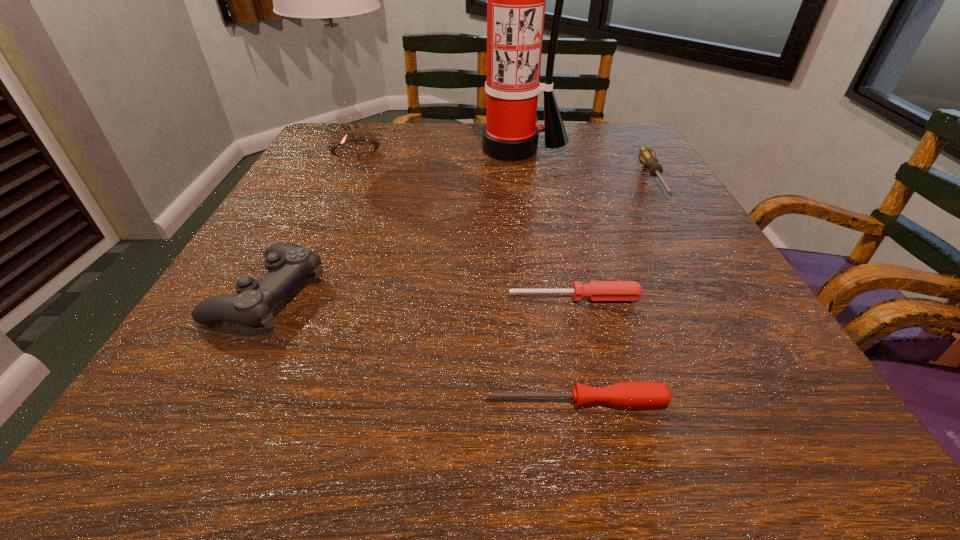
Locate an element on the screen. control that is at the left edge is located at coordinates (287, 263).

Locate an element on the screen. This screenshot has height=540, width=960. object located in the right edge section of the desktop is located at coordinates (647, 157).

The width and height of the screenshot is (960, 540). I want to click on object that is at the far left corner, so click(x=328, y=0).

What are the coordinates of `object that is at the far right corner` in the screenshot? It's located at (647, 157).

Where is `vacant space at the far edge of the desktop`? This screenshot has width=960, height=540. vacant space at the far edge of the desktop is located at coordinates (475, 147).

The height and width of the screenshot is (540, 960). Identify the location of vacant space at the near edge of the desktop. (690, 421).

Locate an element on the screen. blank space at the left edge of the desktop is located at coordinates (343, 204).

Image resolution: width=960 pixels, height=540 pixels. In order to click on vacant space at the right edge of the desktop in this screenshot , I will do `click(618, 199)`.

In the image, there is a desktop. At what (x,y) coordinates should I click in order to perform the action: click on vacant region at the near left corner. Please return your answer as a coordinate pair (x, y). The height and width of the screenshot is (540, 960). Looking at the image, I should click on (217, 427).

You are a GUI agent. You are given a task and a screenshot of the screen. Output one action in this format:
    pyautogui.click(x=<x>, y=<y>)
    Task: Click on the vacant area at the near right corner
    The image size is (960, 540).
    Given the screenshot: What is the action you would take?
    pyautogui.click(x=735, y=441)